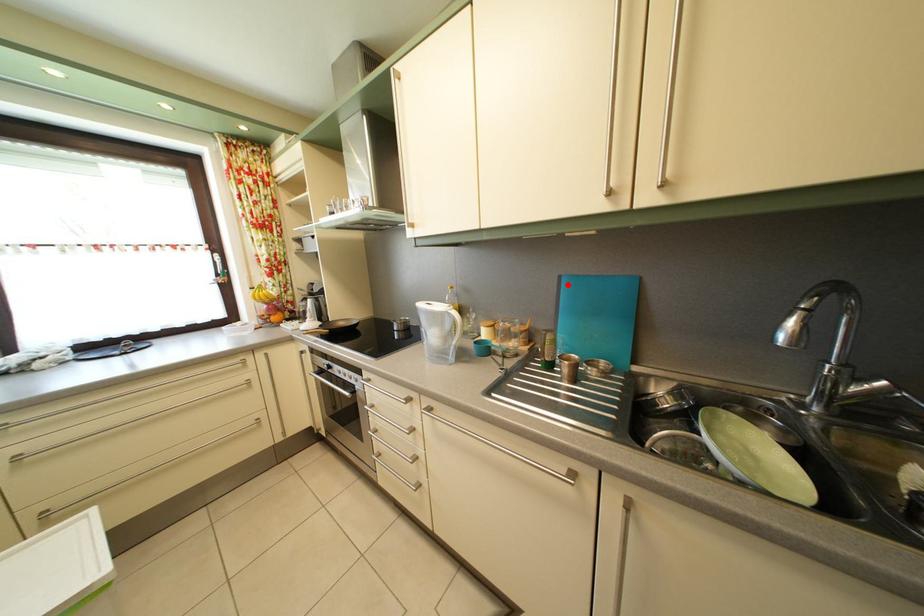
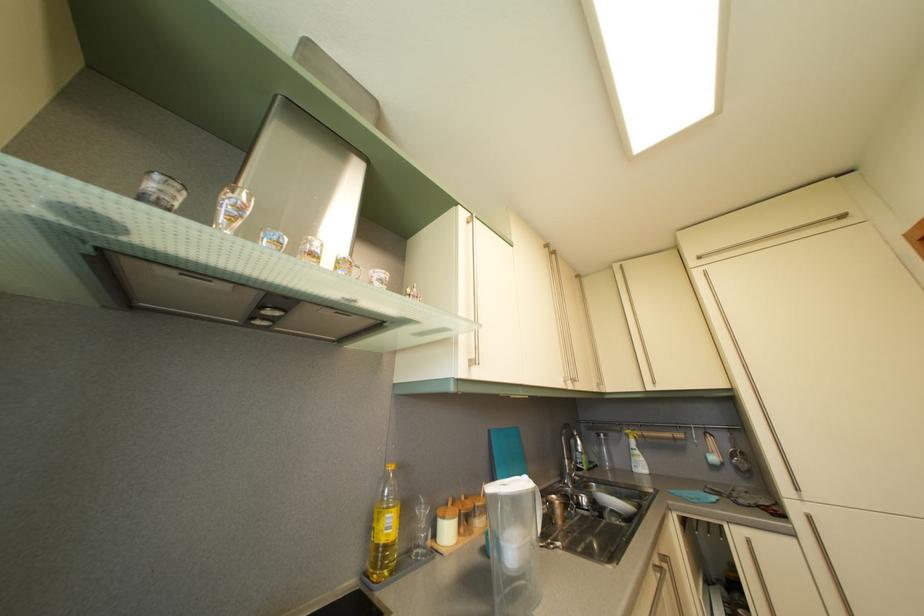
Question: A red point is marked in image1. In image2, is the corresponding 3D point closer to the camera or farther? Reply with the corresponding letter.

Choices:
 (A) The corresponding 3D point is closer.
 (B) The corresponding 3D point is farther.

Answer: (B)